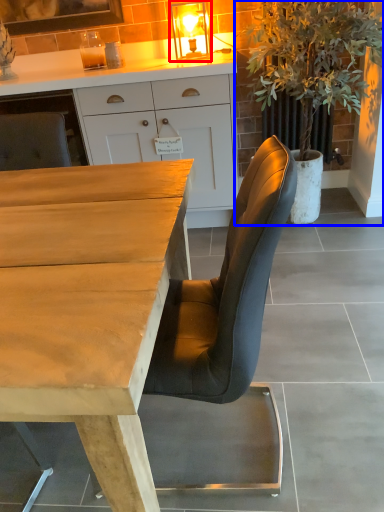
Question: Among these objects, which one is nearest to the camera, light fixture (highlighted by a red box) or houseplant (highlighted by a blue box)?

Choices:
 (A) light fixture
 (B) houseplant

Answer: (B)